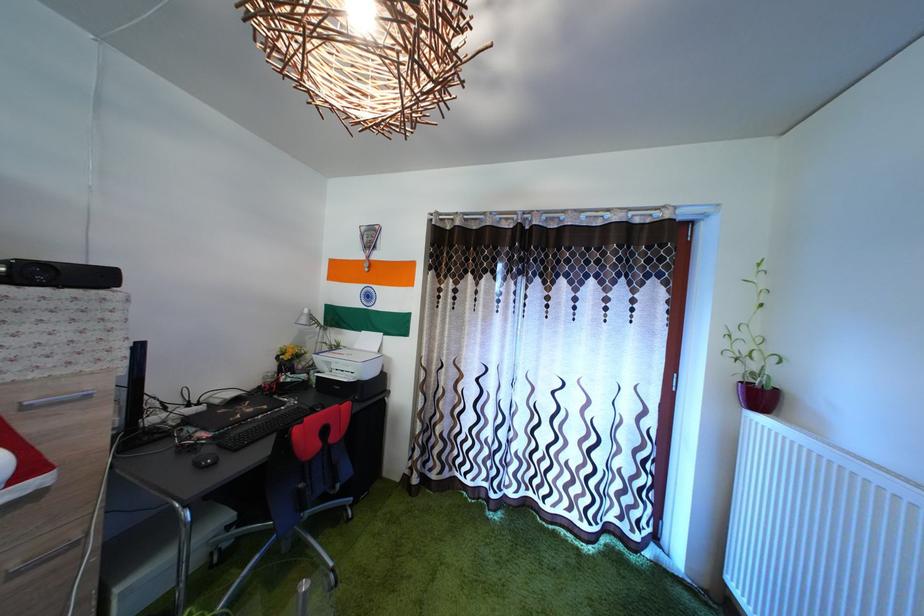
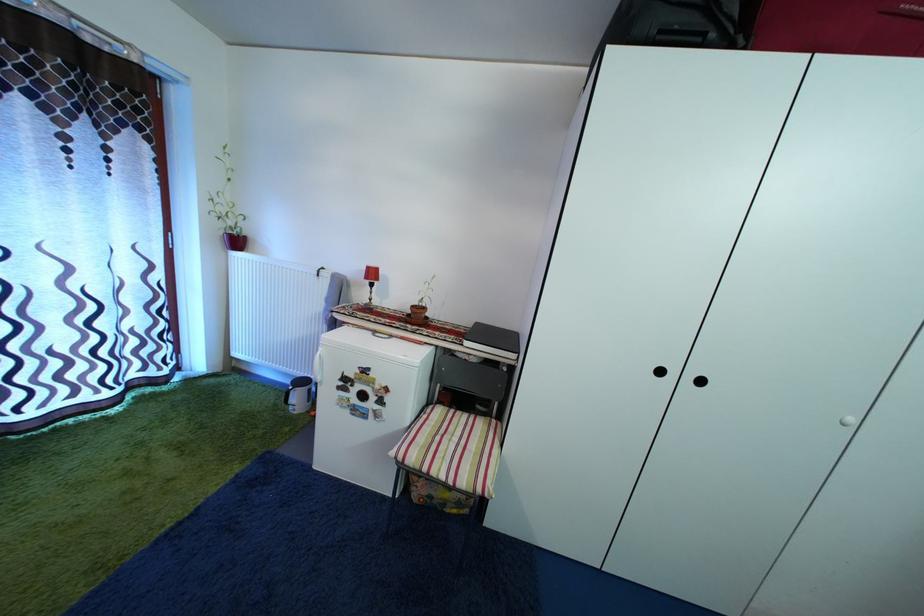
Consider the image. The first image is from the beginning of the video and the second image is from the end. How did the camera likely rotate when shooting the video?

The rotation direction of the camera is right-down.